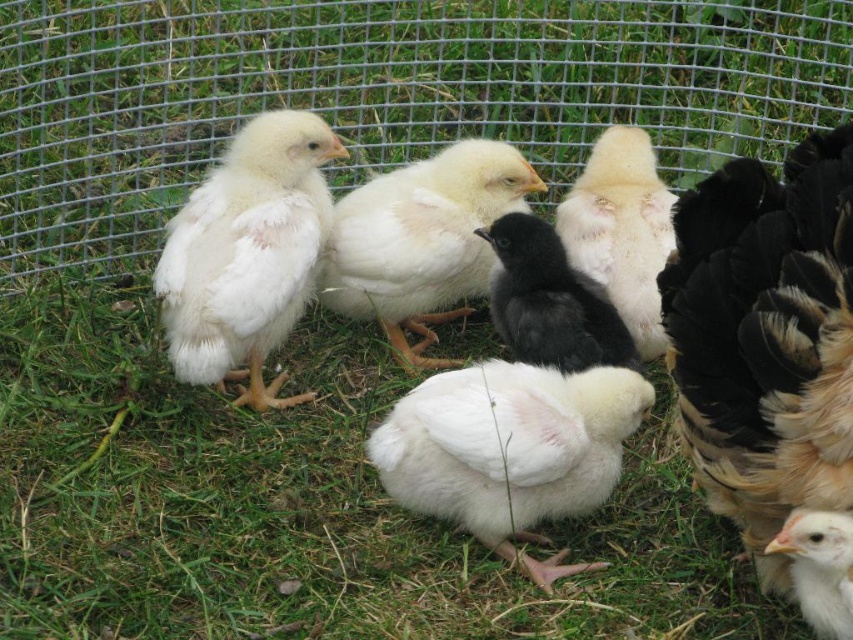
Between green wire mesh at upper center and black feathered chicken at right, which one has less height?

Standing shorter between the two is black feathered chicken at right.

Does green wire mesh at upper center have a greater height compared to black feathered chicken at right?

Indeed, green wire mesh at upper center has a greater height compared to black feathered chicken at right.

This screenshot has height=640, width=853. What do you see at coordinates (378, 96) in the screenshot?
I see `green wire mesh at upper center` at bounding box center [378, 96].

Where is `green wire mesh at upper center`? The width and height of the screenshot is (853, 640). green wire mesh at upper center is located at coordinates (378, 96).

Does black feathered chicken at right have a lesser width compared to white fluffy chicken at center?

Incorrect, black feathered chicken at right's width is not less than white fluffy chicken at center's.

Who is positioned more to the right, black feathered chicken at right or white fluffy chicken at center?

black feathered chicken at right

Locate an element on the screen. The image size is (853, 640). black feathered chicken at right is located at coordinates (764, 339).

In the scene shown: Which is below, white fluffy chick at center or fluffy white chick at center?

white fluffy chick at center is below.

Between white fluffy chick at center and fluffy white chick at center, which one has more height?

Standing taller between the two is fluffy white chick at center.

Does point (410, 477) come behind point (422, 344)?

No, (410, 477) is closer to viewer.

In order to click on white fluffy chick at center in this screenshot , I will do `click(509, 449)`.